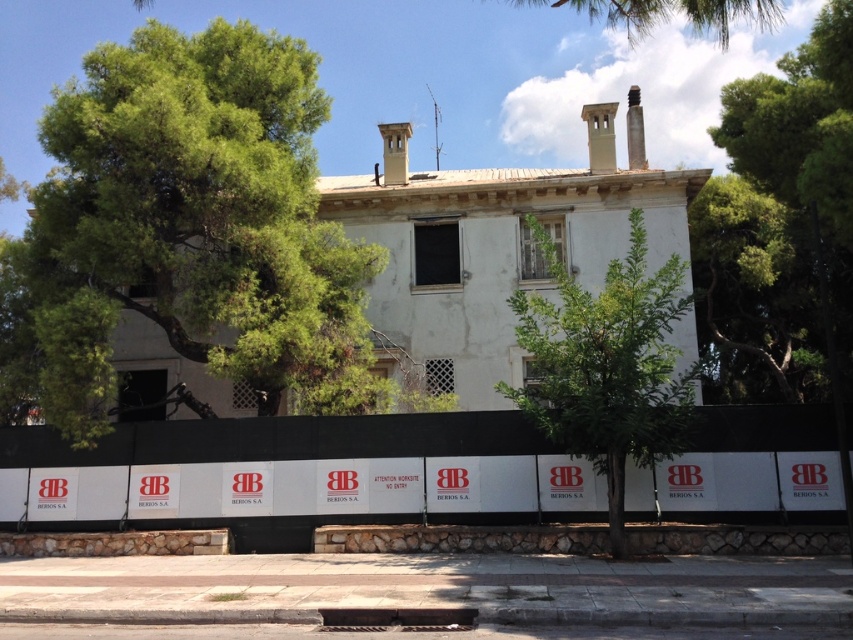
Question: Does green leafy tree at left appear over green leafy tree at upper center?

Choices:
 (A) yes
 (B) no

Answer: (B)

Question: Observing the image, what is the correct spatial positioning of green leafy tree at left in reference to green leafy tree at upper right?

Choices:
 (A) right
 (B) left

Answer: (B)

Question: Which point is farther to the camera?

Choices:
 (A) green leafy tree at upper center
 (B) green leafy tree at center
 (C) green leafy tree at left
 (D) green leafy tree at upper right

Answer: (C)

Question: Observing the image, what is the correct spatial positioning of green leafy tree at left in reference to green leafy tree at upper center?

Choices:
 (A) below
 (B) above

Answer: (A)

Question: Which object is positioned closest to the green leafy tree at center?

Choices:
 (A) green leafy tree at upper right
 (B) green leafy tree at left

Answer: (B)

Question: Estimate the real-world distances between objects in this image. Which object is farther from the green leafy tree at upper center?

Choices:
 (A) green leafy tree at left
 (B) green leafy tree at upper right

Answer: (A)